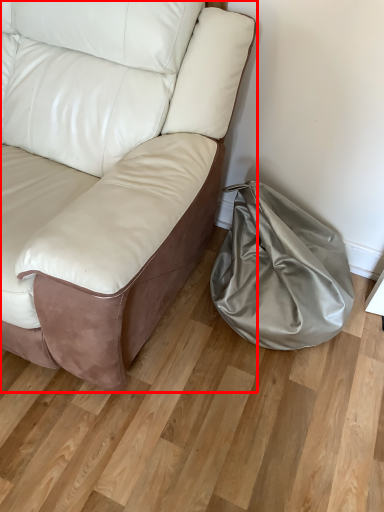
Question: Considering the relative positions of studio couch (annotated by the red box) and bean bag chair in the image provided, where is studio couch (annotated by the red box) located with respect to the staircase?

Choices:
 (A) left
 (B) right

Answer: (A)